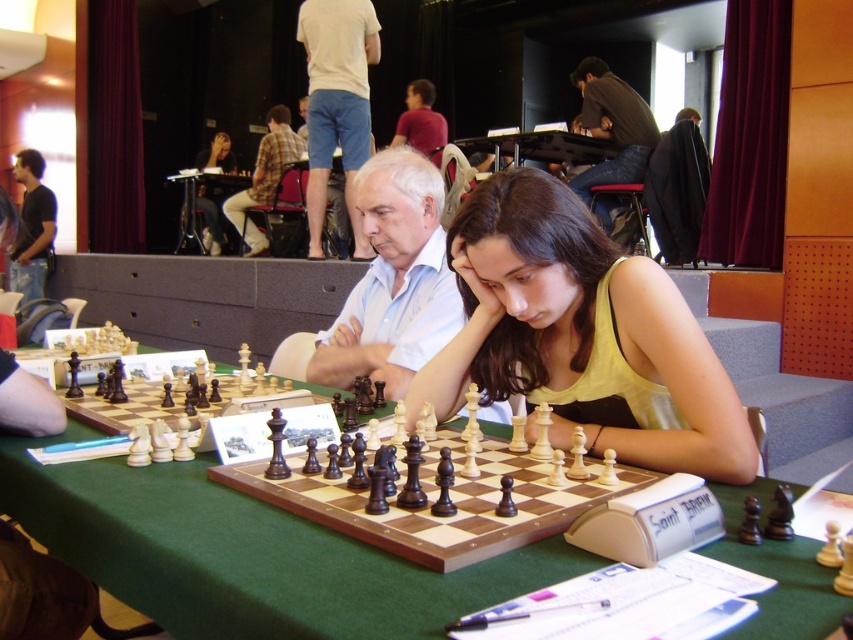
Question: Considering the real-world distances, which object is closest to the dark brown shirt at upper center?

Choices:
 (A) black t-shirt at left
 (B) matte black chessboard at upper center
 (C) yellow fabric shirt at center

Answer: (C)

Question: Is yellow fabric shirt at center positioned behind plaid fabric shirt at center?

Choices:
 (A) yes
 (B) no

Answer: (B)

Question: Is black t-shirt at left below matte black chessboard at upper center?

Choices:
 (A) yes
 (B) no

Answer: (A)

Question: Which point appears farthest from the camera in this image?

Choices:
 (A) (288, 160)
 (B) (28, 164)

Answer: (B)

Question: Does dark brown shirt at upper center appear over plaid fabric shirt at center?

Choices:
 (A) no
 (B) yes

Answer: (A)

Question: Which of the following is the closest to the observer?

Choices:
 (A) (637, 161)
 (B) (408, 168)
 (C) (271, 113)
 (D) (212, 243)

Answer: (B)